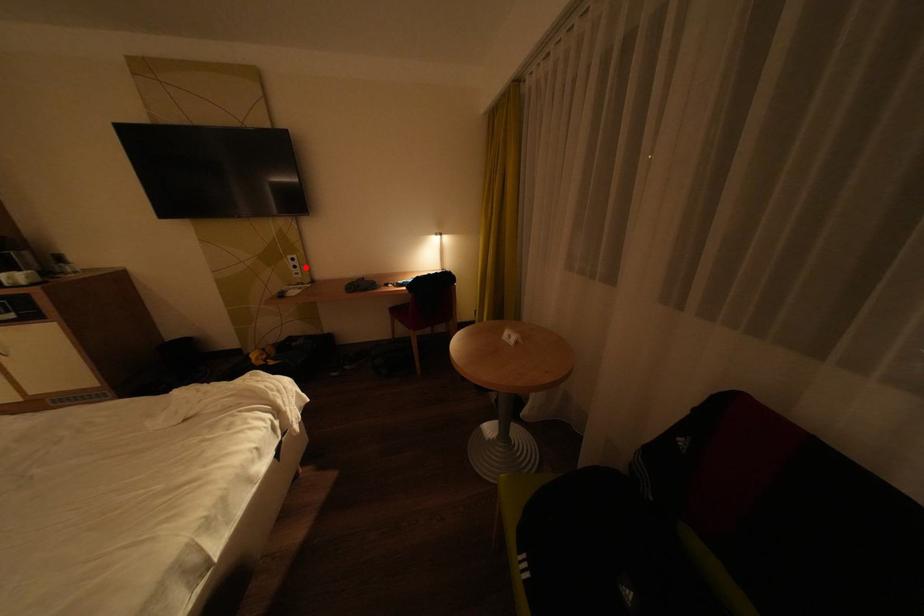
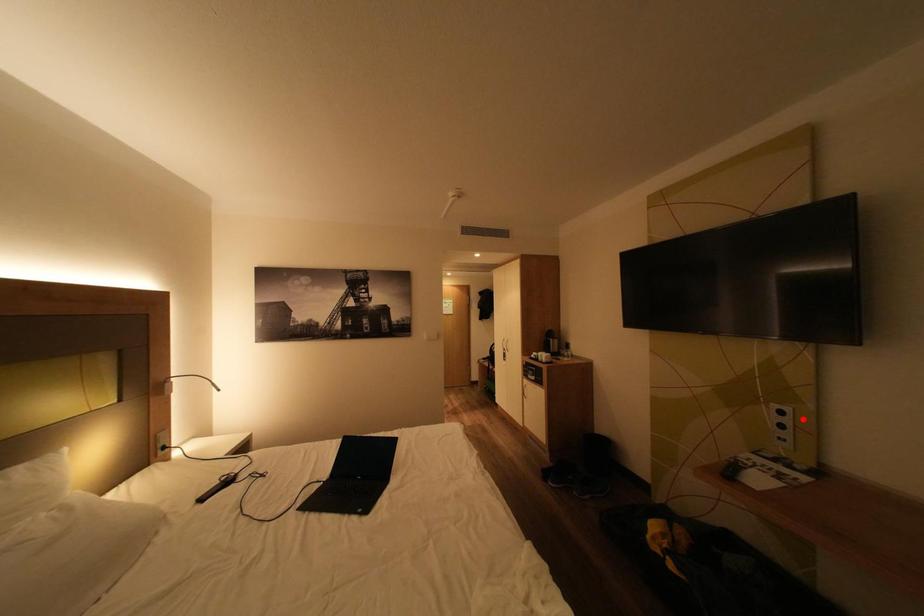
I am providing you with two images of the same scene from different viewpoints. A red point is marked on the first image and another point is marked on the second image. Is the red point in image1 aligned with the point shown in image2?

No